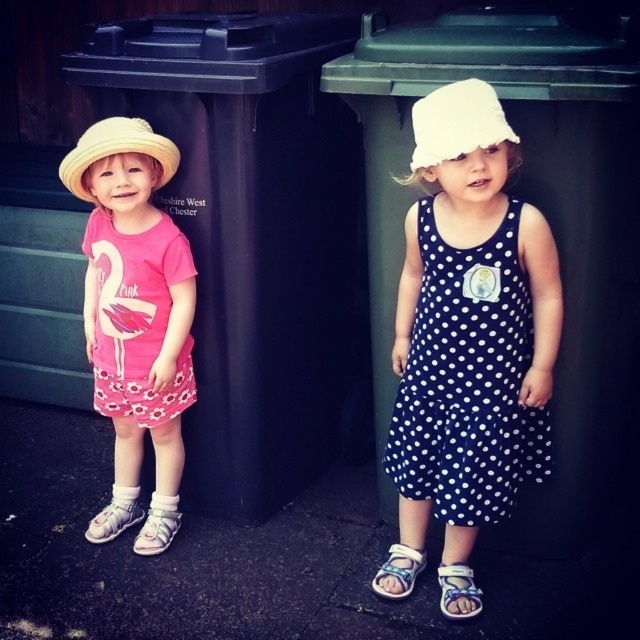
You are trying to decide whether to place the blue fabric sandal at lower center into the black plastic recycling bin at left. Based on their sizes, will the sandal fit inside the bin?

The black plastic recycling bin at left is taller than the blue fabric sandal at lower center, so the sandal should fit inside the bin.

You are a photographer trying to capture both children in a single shot. The children are standing at point (356, 301) and point (442, 577). Since you want to ensure both are in focus, which child should you focus on first to maximize the chances of both being clear?

You should focus on the child at point (356, 301) first because it is closer to the viewer than the child at point (442, 577). Focusing on the closer subject increases the likelihood that both will be in focus.

You are a parent trying to decide which trash bin to place a tall cardboard box. You see the green plastic recycling bin at upper center and the navy polka dot dress at right. Which bin is taller?

The green plastic recycling bin at upper center is much taller than the navy polka dot dress at right, so the recycling bin is the taller one.